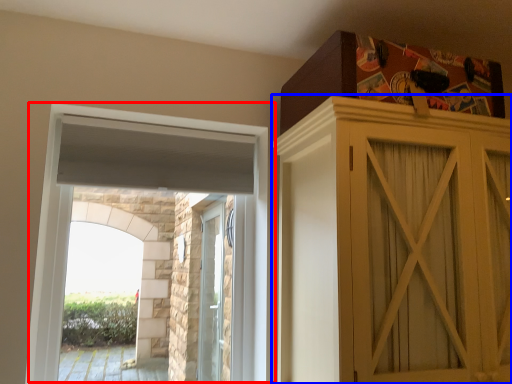
Question: Among these objects, which one is nearest to the camera, window (highlighted by a red box) or cupboard (highlighted by a blue box)?

Choices:
 (A) window
 (B) cupboard

Answer: (B)